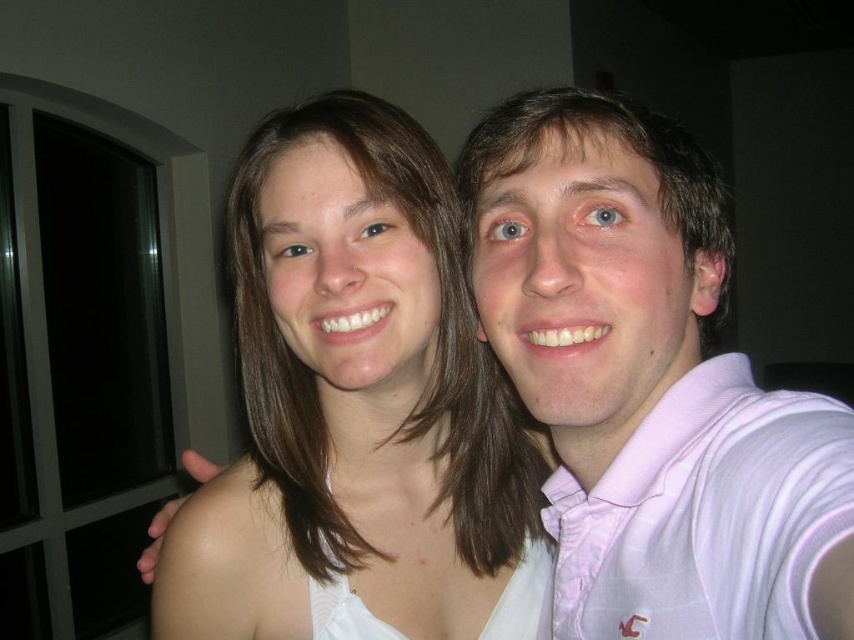
Which of these two, white fabric at center or pink striped polo shirt at upper right, stands shorter?

pink striped polo shirt at upper right is shorter.

Which is in front, point (250, 216) or point (717, 476)?

Point (717, 476) is more forward.

You are a GUI agent. You are given a task and a screenshot of the screen. Output one action in this format:
    pyautogui.click(x=<x>, y=<y>)
    Task: Click on the white fabric at center
    This screenshot has width=854, height=640.
    Given the screenshot: What is the action you would take?
    pyautogui.click(x=357, y=410)

Based on the photo, is white fabric at center closer to the viewer compared to pink cotton polo shirt at right?

No, it is behind pink cotton polo shirt at right.

Is white fabric at center to the right of pink cotton polo shirt at right from the viewer's perspective?

Incorrect, white fabric at center is not on the right side of pink cotton polo shirt at right.

Locate an element on the screen. white fabric at center is located at coordinates (357, 410).

Between pink striped polo shirt at upper right and pink cotton polo shirt at right, which one has more height?

With more height is pink striped polo shirt at upper right.

Between pink striped polo shirt at upper right and pink cotton polo shirt at right, which one is positioned lower?

pink cotton polo shirt at right

Identify the location of pink striped polo shirt at upper right. This screenshot has height=640, width=854. (648, 385).